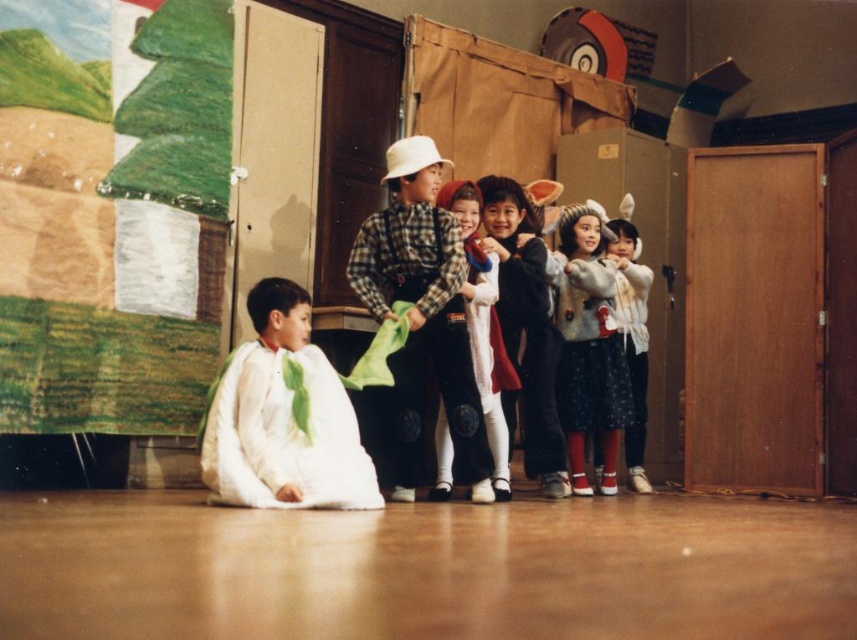
Can you confirm if white matte/soft fabric at lower left is taller than checkered fabric shirt at center?

No, white matte/soft fabric at lower left is not taller than checkered fabric shirt at center.

Is white matte/soft fabric at lower left positioned in front of checkered fabric shirt at center?

Yes, it is in front of checkered fabric shirt at center.

What do you see at coordinates (283, 417) in the screenshot?
I see `white matte/soft fabric at lower left` at bounding box center [283, 417].

Locate an element on the screen. white matte/soft fabric at lower left is located at coordinates (283, 417).

Does fluffy white sweater at center appear on the left side of green fabric tie at lower center?

Incorrect, fluffy white sweater at center is not on the left side of green fabric tie at lower center.

Can you confirm if fluffy white sweater at center is shorter than green fabric tie at lower center?

No.

Who is more distant from viewer, (500, 352) or (298, 397)?

Point (500, 352)

Identify the location of fluffy white sweater at center. (483, 330).

Locate an element on the screen. Image resolution: width=857 pixels, height=640 pixels. white matte/soft fabric at lower left is located at coordinates (283, 417).

Can you confirm if white matte/soft fabric at lower left is positioned to the left of green fabric tie at lower center?

Correct, you'll find white matte/soft fabric at lower left to the left of green fabric tie at lower center.

Describe the element at coordinates (283, 417) in the screenshot. I see `white matte/soft fabric at lower left` at that location.

Locate an element on the screen. The image size is (857, 640). white matte/soft fabric at lower left is located at coordinates (283, 417).